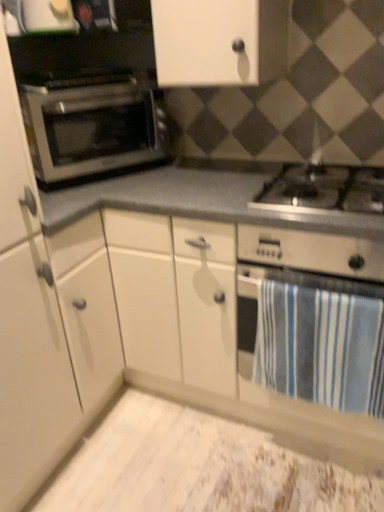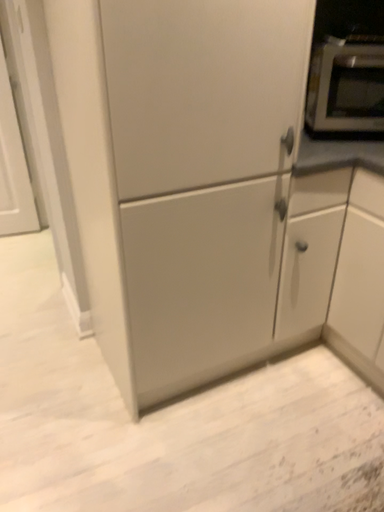
Question: Which way did the camera rotate in the video?

Choices:
 (A) rotated left
 (B) rotated right

Answer: (A)